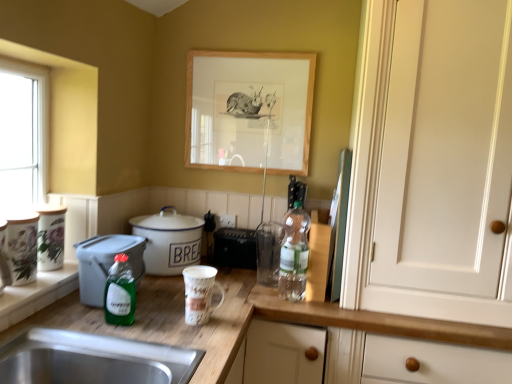
Question: Considering the relative positions of green glass bottle at center, which ranks as the 1th bottle in left-to-right order, and green plastic container at left, acting as the 1th cooker starting from the front, in the image provided, is green glass bottle at center, which ranks as the 1th bottle in left-to-right order, to the right of green plastic container at left, acting as the 1th cooker starting from the front, from the viewer's perspective?

Choices:
 (A) no
 (B) yes

Answer: (B)

Question: Is green plastic container at left, arranged as the second cooker when viewed from the back, a part of green glass bottle at center, which ranks as the 1th bottle in left-to-right order?

Choices:
 (A) yes
 (B) no

Answer: (B)

Question: Is green glass bottle at center, the first bottle in the front-to-back sequence, not close to green plastic container at left, acting as the 1th cooker starting from the front?

Choices:
 (A) no
 (B) yes

Answer: (A)

Question: Can you see green glass bottle at center, the first bottle in the front-to-back sequence, touching green plastic container at left, arranged as the second cooker when viewed from the back?

Choices:
 (A) no
 (B) yes

Answer: (A)

Question: Is green glass bottle at center, which is the 2th bottle in back-to-front order, thinner than green plastic container at left, arranged as the second cooker when viewed from the back?

Choices:
 (A) yes
 (B) no

Answer: (A)

Question: Is point (138, 220) positioned closer to the camera than point (196, 273)?

Choices:
 (A) farther
 (B) closer

Answer: (A)

Question: From the image's perspective, is white enamel cooker at center, the 2th cooker viewed from the front, located above or below matte ceramic mug at center, the fourth appliance viewed from the back?

Choices:
 (A) above
 (B) below

Answer: (A)

Question: From a real-world perspective, relative to matte ceramic mug at center, positioned as the first appliance in front-to-back order, is white enamel cooker at center, positioned as the first cooker in back-to-front order, vertically above or below?

Choices:
 (A) below
 (B) above

Answer: (B)

Question: From their relative heights in the image, would you say white enamel cooker at center, the 2th cooker viewed from the front, is taller or shorter than matte ceramic mug at center, which is the third appliance in right-to-left order?

Choices:
 (A) tall
 (B) short

Answer: (A)

Question: Considering the positions of translucent plastic bottle at center, the 2th bottle when ordered from front to back, and matte ceramic mug at center, the fourth appliance viewed from the back, in the image, is translucent plastic bottle at center, the 2th bottle when ordered from front to back, bigger or smaller than matte ceramic mug at center, the fourth appliance viewed from the back,?

Choices:
 (A) big
 (B) small

Answer: (A)

Question: Is translucent plastic bottle at center, the first bottle from the right, inside the boundaries of matte ceramic mug at center, which is the third appliance in right-to-left order, or outside?

Choices:
 (A) outside
 (B) inside

Answer: (A)

Question: Is translucent plastic bottle at center, the second bottle when ordered from left to right, wider or thinner than matte ceramic mug at center, the second appliance from the left?

Choices:
 (A) wide
 (B) thin

Answer: (B)

Question: From a real-world perspective, is translucent plastic bottle at center, the first bottle from the right, physically located above or below matte ceramic mug at center, the second appliance from the left?

Choices:
 (A) below
 (B) above

Answer: (B)

Question: Is green matte refrigerator at center-right, which is the 3th appliance from front to back, wider or thinner than white enamel cooker at center, positioned as the first cooker in back-to-front order?

Choices:
 (A) wide
 (B) thin

Answer: (B)

Question: Relative to white enamel cooker at center, positioned as the first cooker in back-to-front order, is green matte refrigerator at center-right, placed as the first appliance when sorted from right to left, in front or behind?

Choices:
 (A) behind
 (B) front

Answer: (B)